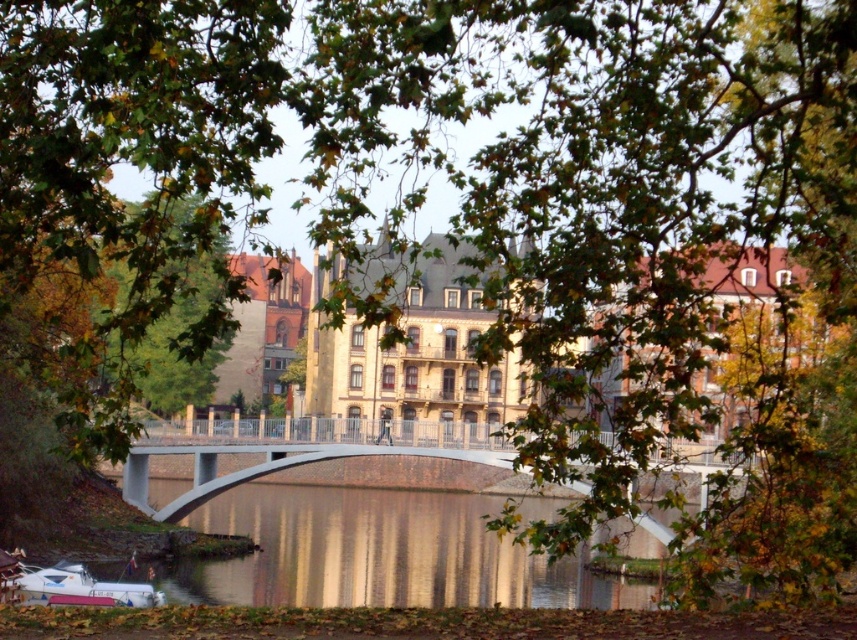
Between glossy reflective water at center and concrete bridge at center, which one appears on the left side from the viewer's perspective?

From the viewer's perspective, glossy reflective water at center appears more on the left side.

Between point (361, 604) and point (327, 451), which one is positioned behind?

Point (327, 451)

The height and width of the screenshot is (640, 857). Find the location of `glossy reflective water at center`. glossy reflective water at center is located at coordinates (381, 554).

Does concrete bridge at center come behind white glossy boat at lower left?

No, concrete bridge at center is in front of white glossy boat at lower left.

Describe the element at coordinates (286, 468) in the screenshot. This screenshot has height=640, width=857. I see `concrete bridge at center` at that location.

The image size is (857, 640). Identify the location of concrete bridge at center. (286, 468).

Which is behind, point (430, 589) or point (84, 580)?

The point (430, 589) is more distant.

Find the location of a particular element. glossy reflective water at center is located at coordinates click(381, 554).

Identify the location of glossy reflective water at center. Image resolution: width=857 pixels, height=640 pixels. (381, 554).